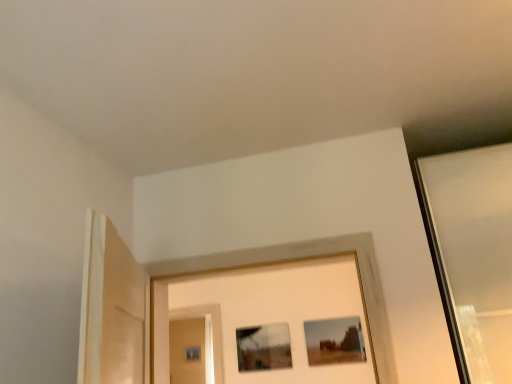
Looking at this image, what is the approximate height of matte glass picture frame at center, which appears as the 2th picture frame when viewed from the right?

13.05 inches.

The height and width of the screenshot is (384, 512). Identify the location of matte brown picture frame at center, which is counted as the 2th picture frame, starting from the left. (334, 341).

How different are the orientations of matte brown picture frame at center, the 1th picture frame from the right, and matte glass screen door at center in degrees?

0.339 degrees separate the facing orientations of matte brown picture frame at center, the 1th picture frame from the right, and matte glass screen door at center.

Are matte brown picture frame at center, the 1th picture frame from the right, and matte glass screen door at center making contact?

matte brown picture frame at center, the 1th picture frame from the right, and matte glass screen door at center are not in contact.

Considering the relative sizes of matte brown picture frame at center, the 1th picture frame from the right, and matte glass screen door at center in the image provided, is matte brown picture frame at center, the 1th picture frame from the right, wider than matte glass screen door at center?

In fact, matte brown picture frame at center, the 1th picture frame from the right, might be narrower than matte glass screen door at center.

Is matte brown picture frame at center, which is counted as the 2th picture frame, starting from the left, surrounding matte glass screen door at center?

Actually, matte glass screen door at center is outside matte brown picture frame at center, which is counted as the 2th picture frame, starting from the left.

The height and width of the screenshot is (384, 512). Identify the location of the 1st picture frame counting from the right side of the matte glass screen door at center. (263, 347).

Based on the photo, which object is further away from the camera taking this photo, matte glass picture frame at center, which appears as the 2th picture frame when viewed from the right, or matte glass screen door at center?

matte glass screen door at center.

Is matte glass picture frame at center, which is counted as the 1th picture frame, starting from the left, facing towards matte glass screen door at center?

No, matte glass picture frame at center, which is counted as the 1th picture frame, starting from the left, is not turned towards matte glass screen door at center.

Considering the relative sizes of matte glass screen door at center and matte brown picture frame at center, which is counted as the 2th picture frame, starting from the left, in the image provided, is matte glass screen door at center wider than matte brown picture frame at center, which is counted as the 2th picture frame, starting from the left,?

Yes.

From a real-world perspective, relative to matte brown picture frame at center, the 1th picture frame from the right, is matte glass screen door at center vertically above or below?

In terms of real-world spatial position, matte glass screen door at center is below matte brown picture frame at center, the 1th picture frame from the right.

Is matte glass screen door at center closer to camera compared to matte brown picture frame at center, the 1th picture frame from the right?

No, it is not.

Between matte glass screen door at center and matte brown picture frame at center, the 1th picture frame from the right, which one has larger size?

matte glass screen door at center is bigger.

Considering the relative positions of matte glass picture frame at center, which is counted as the 1th picture frame, starting from the left, and matte brown picture frame at center, which is counted as the 2th picture frame, starting from the left, in the image provided, is matte glass picture frame at center, which is counted as the 1th picture frame, starting from the left, behind matte brown picture frame at center, which is counted as the 2th picture frame, starting from the left,?

Yes, matte glass picture frame at center, which is counted as the 1th picture frame, starting from the left, is behind matte brown picture frame at center, which is counted as the 2th picture frame, starting from the left.

Does matte glass picture frame at center, which is counted as the 1th picture frame, starting from the left, have a lesser width compared to matte brown picture frame at center, which is counted as the 2th picture frame, starting from the left?

In fact, matte glass picture frame at center, which is counted as the 1th picture frame, starting from the left, might be wider than matte brown picture frame at center, which is counted as the 2th picture frame, starting from the left.

Which is nearer, (287, 352) or (362, 356)?

Clearly, point (287, 352) is more distant from the camera than point (362, 356).

Is matte brown picture frame at center, the 1th picture frame from the right, surrounded by matte glass picture frame at center, which is counted as the 1th picture frame, starting from the left?

No, matte brown picture frame at center, the 1th picture frame from the right, is not surrounded by matte glass picture frame at center, which is counted as the 1th picture frame, starting from the left.

Which is closer, (188, 379) or (282, 356)?

Clearly, point (188, 379) is more distant from the camera than point (282, 356).

From the image's perspective, which one is positioned higher, matte glass screen door at center or matte glass picture frame at center, which is counted as the 1th picture frame, starting from the left?

matte glass picture frame at center, which is counted as the 1th picture frame, starting from the left, is shown above in the image.

Considering the relative positions of matte glass screen door at center and matte glass picture frame at center, which appears as the 2th picture frame when viewed from the right, in the image provided, is matte glass screen door at center to the right of matte glass picture frame at center, which appears as the 2th picture frame when viewed from the right, from the viewer's perspective?

No.

Does matte glass screen door at center come in front of matte glass picture frame at center, which appears as the 2th picture frame when viewed from the right?

No, the depth of matte glass screen door at center is greater than that of matte glass picture frame at center, which appears as the 2th picture frame when viewed from the right.

Considering the relative sizes of matte brown picture frame at center, the 1th picture frame from the right, and matte glass picture frame at center, which appears as the 2th picture frame when viewed from the right, in the image provided, is matte brown picture frame at center, the 1th picture frame from the right, bigger than matte glass picture frame at center, which appears as the 2th picture frame when viewed from the right,?

No.

In terms of width, does matte brown picture frame at center, which is counted as the 2th picture frame, starting from the left, look wider or thinner when compared to matte glass picture frame at center, which is counted as the 1th picture frame, starting from the left?

Considering their sizes, matte brown picture frame at center, which is counted as the 2th picture frame, starting from the left, looks slimmer than matte glass picture frame at center, which is counted as the 1th picture frame, starting from the left.

Which is more distant, (305, 334) or (251, 338)?

The point (251, 338) is behind.

From the image's perspective, does matte brown picture frame at center, which is counted as the 2th picture frame, starting from the left, appear lower than matte glass picture frame at center, which is counted as the 1th picture frame, starting from the left?

No, from the image's perspective, matte brown picture frame at center, which is counted as the 2th picture frame, starting from the left, is not below matte glass picture frame at center, which is counted as the 1th picture frame, starting from the left.

From the image's perspective, which picture frame is the 2nd one above the matte glass screen door at center? Please provide its 2D coordinates.

[(334, 341)]

Image resolution: width=512 pixels, height=384 pixels. In order to click on picture frame that is the 1st one when counting rightward from the matte glass screen door at center in this screenshot , I will do `click(263, 347)`.

When comparing their distances from matte glass screen door at center, does matte glass picture frame at center, which is counted as the 1th picture frame, starting from the left, or matte brown picture frame at center, the 1th picture frame from the right, seem closer?

Based on the image, matte glass picture frame at center, which is counted as the 1th picture frame, starting from the left, appears to be nearer to matte glass screen door at center.

From the image, which object appears to be farther from matte brown picture frame at center, which is counted as the 2th picture frame, starting from the left, matte glass picture frame at center, which appears as the 2th picture frame when viewed from the right, or matte glass screen door at center?

Among the two, matte glass screen door at center is located further to matte brown picture frame at center, which is counted as the 2th picture frame, starting from the left.

In the scene shown: Based on their spatial positions, is matte glass screen door at center or matte glass picture frame at center, which appears as the 2th picture frame when viewed from the right, further from matte brown picture frame at center, the 1th picture frame from the right?

The object further to matte brown picture frame at center, the 1th picture frame from the right, is matte glass screen door at center.

Based on their spatial positions, is matte glass screen door at center or matte brown picture frame at center, which is counted as the 2th picture frame, starting from the left, closer to matte glass picture frame at center, which appears as the 2th picture frame when viewed from the right?

Among the two, matte brown picture frame at center, which is counted as the 2th picture frame, starting from the left, is located nearer to matte glass picture frame at center, which appears as the 2th picture frame when viewed from the right.

Estimate the real-world distances between objects in this image. Which object is further from matte glass picture frame at center, which appears as the 2th picture frame when viewed from the right, matte brown picture frame at center, the 1th picture frame from the right, or matte glass screen door at center?

The object further to matte glass picture frame at center, which appears as the 2th picture frame when viewed from the right, is matte glass screen door at center.

Considering their positions, is matte brown picture frame at center, which is counted as the 2th picture frame, starting from the left, positioned further to matte glass screen door at center than matte glass picture frame at center, which appears as the 2th picture frame when viewed from the right?

matte brown picture frame at center, which is counted as the 2th picture frame, starting from the left.

At what (x,y) coordinates should I click in order to perform the action: click on picture frame between matte glass screen door at center and matte brown picture frame at center, the 1th picture frame from the right, in the horizontal direction. Please return your answer as a coordinate pair (x, y). Looking at the image, I should click on (263, 347).